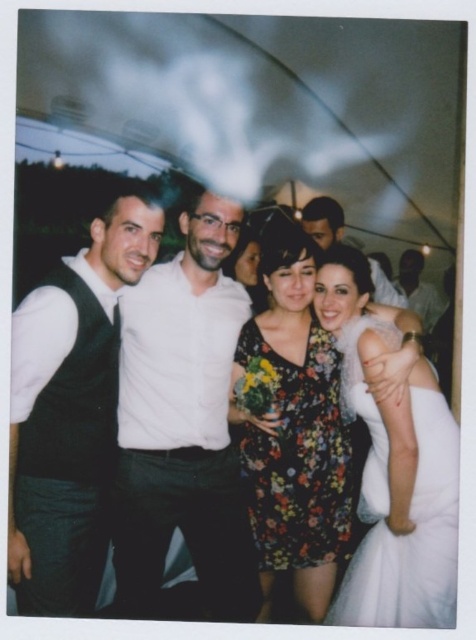
Is white matte shirt at center thinner than dark brown leather jacket at upper right?

No.

Is point (125, 353) more distant than point (398, 262)?

No, (125, 353) is closer to viewer.

What are the coordinates of `white matte shirt at center` in the screenshot? It's located at (184, 420).

Can you confirm if white matte shirt at center is positioned to the left of matte white shirt at center?

→ Indeed, white matte shirt at center is positioned on the left side of matte white shirt at center.

Is white matte shirt at center positioned behind matte white shirt at center?

No, white matte shirt at center is in front of matte white shirt at center.

Is point (161, 561) behind point (385, 289)?

No, (161, 561) is in front of (385, 289).

Identify the location of white matte shirt at center. click(x=184, y=420).

This screenshot has width=476, height=640. Find the location of `floral dress at center`. floral dress at center is located at coordinates (181, 429).